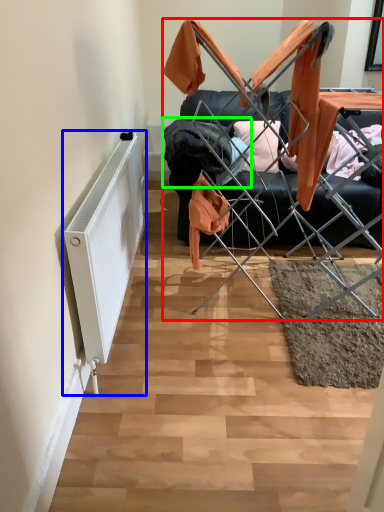
Question: Which object is positioned farthest from furniture (highlighted by a red box)? Select from radiator (highlighted by a blue box) and clothing (highlighted by a green box).

Choices:
 (A) radiator
 (B) clothing

Answer: (A)